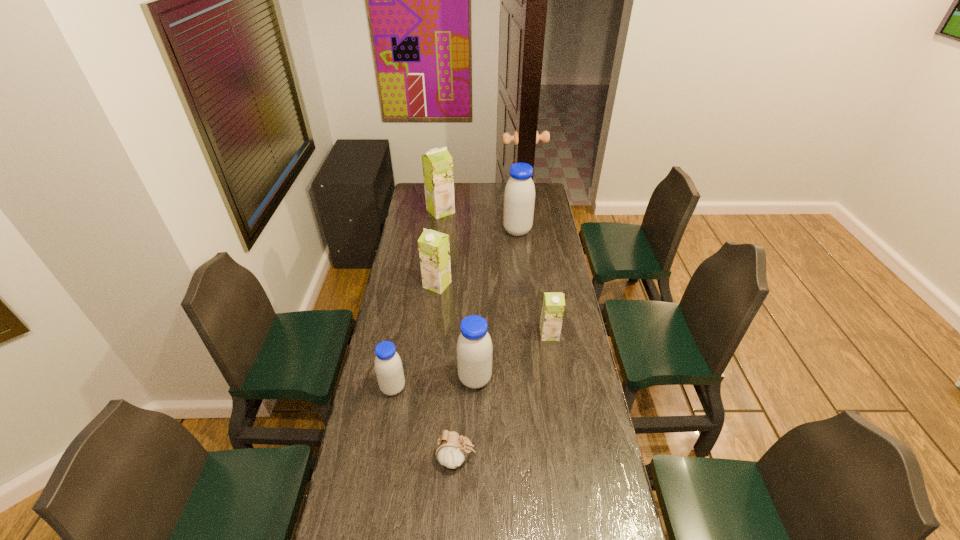
You are a GUI agent. You are given a task and a screenshot of the screen. Output one action in this format:
    pyautogui.click(x=<x>, y=<y>)
    Task: Click on the blank space that satisfies the following two spatial constraints: 1. on the back side of the fifth nearest soya milk; 2. on the left side of the third soya milk from right to left
    The image size is (960, 540).
    Given the screenshot: What is the action you would take?
    pyautogui.click(x=476, y=231)